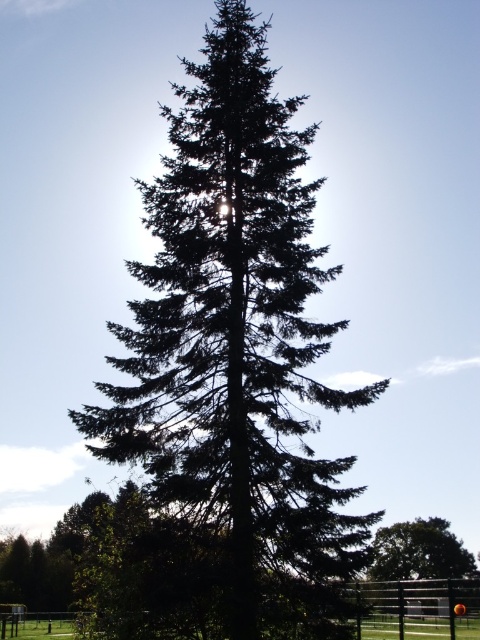
Which is below, green needle-like at center or green matte tree at lower right?

green matte tree at lower right is below.

Who is positioned more to the left, green needle-like at center or green matte tree at lower right?

Positioned to the left is green needle-like at center.

Describe the element at coordinates (235, 339) in the screenshot. I see `green needle-like at center` at that location.

Find the location of `green needle-like at center`. green needle-like at center is located at coordinates (235, 339).